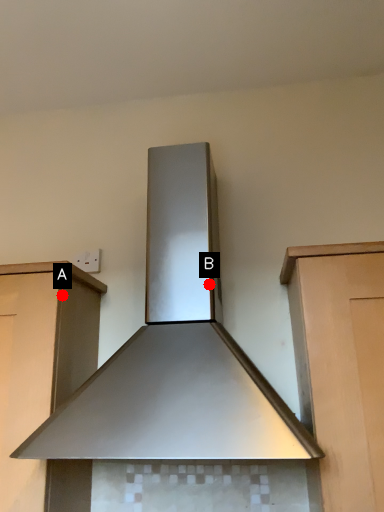
Question: Two points are circled on the image, labeled by A and B beside each circle. Which point is closer to the camera taking this photo?

Choices:
 (A) A is closer
 (B) B is closer

Answer: (A)